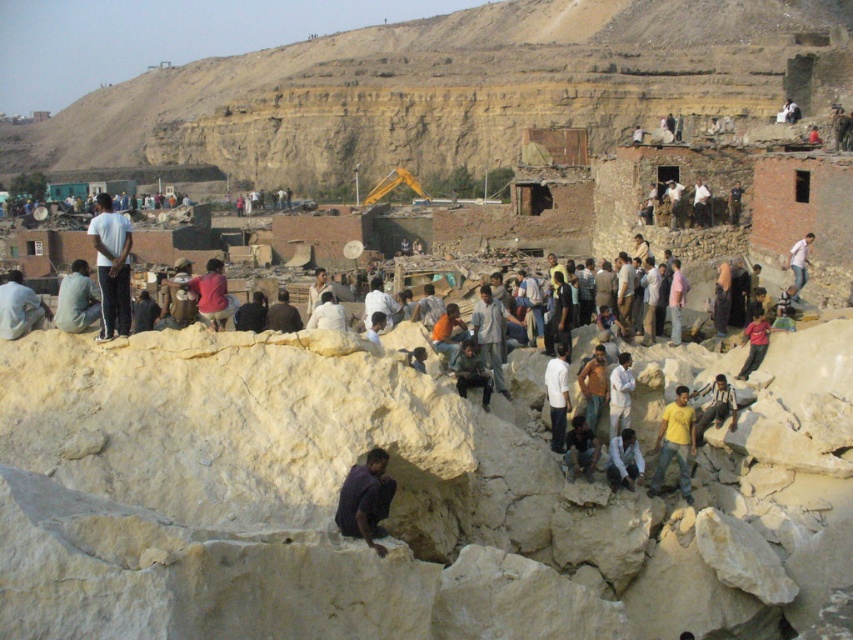
You are a photographer standing on the rugged light colored rock formation in the foreground. You want to take a photo of the dark purple shirt at lower center and the light brown leather jacket at lower right. Which person is closer to the front of the photo?

The dark purple shirt at lower center is positioned under the light brown leather jacket at lower right, so the dark purple shirt at lower center is closer to the front of the photo.

You are standing at the center of the rocky terrain and want to locate the light brown fabric shirt at upper left. According to the coordinates provided, in which direction should you look to find it?

The light brown fabric shirt at upper left is located at coordinates point (76,300), which means you should look towards the upper left direction to find it.